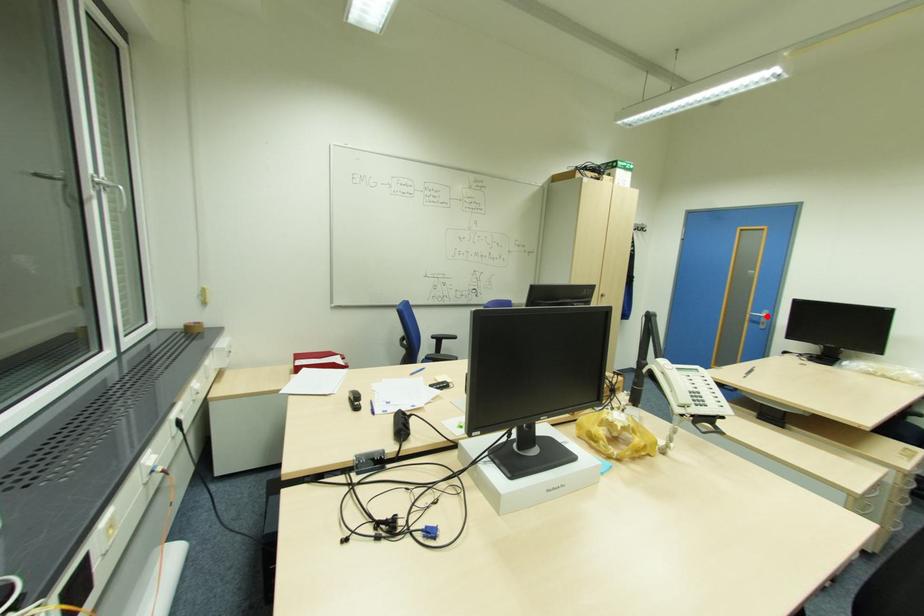
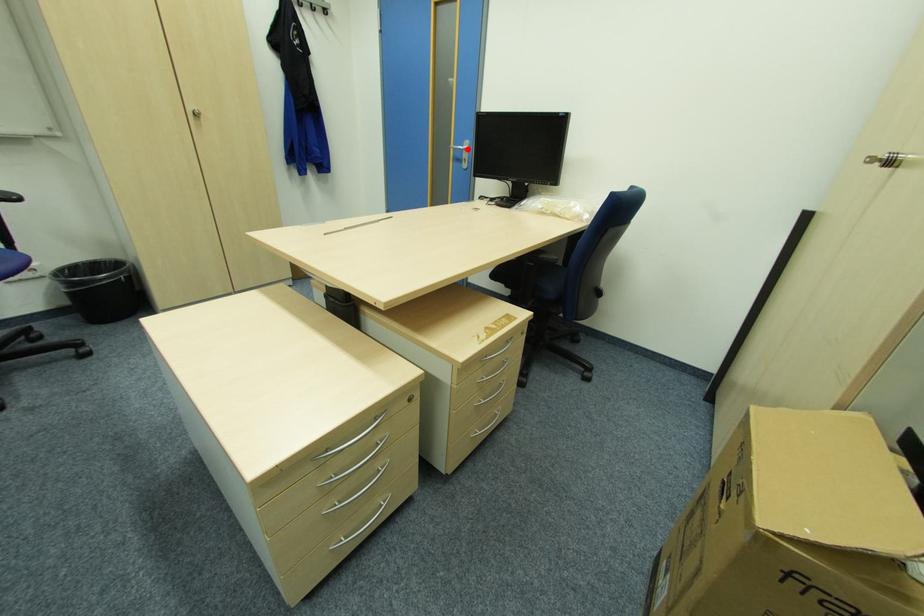
I am providing you with two images of the same scene from different viewpoints. A red point is marked on the first image and another point is marked on the second image. Are the points marked in image1 and image2 representing the same 3D position?

Yes